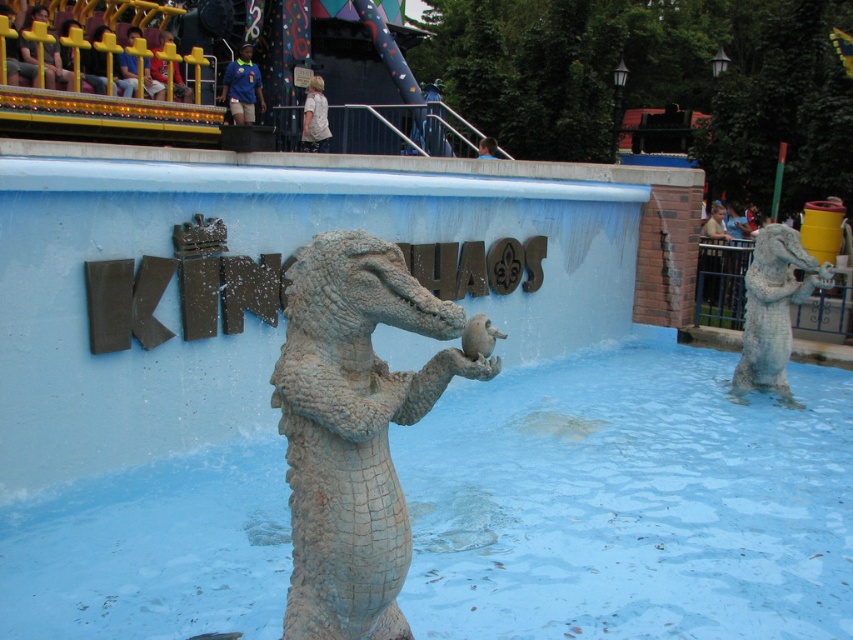
You are a maintenance worker at the amusement park. You need to place a 24 inch long maintenance ladder between the gray stone crocodile at center and the matte gray statue at center. Can the ladder fit between them without overlapping either object?

The distance between the gray stone crocodile at center and the matte gray statue at center is 25.12 inches. Since the ladder is 24 inches long, it can fit between them without overlapping either object as there is enough space.

You are a visitor at the amusement park and want to take a photo with both the gray stone crocodile at center and the gray stone statue at center. Since you want to include both in the frame, which one should you stand closer to?

You should stand closer to the gray stone crocodile at center because it is shorter than the gray stone statue at center, allowing both to be in the frame more easily.